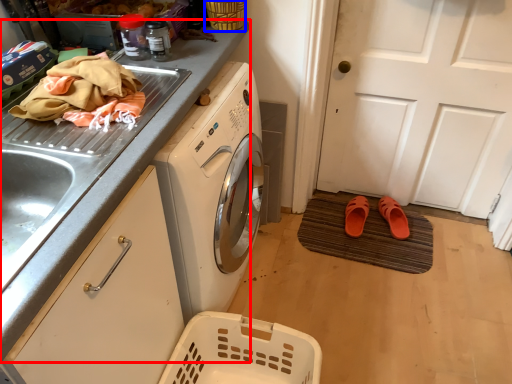
Question: Which of the following is the farthest to the observer, countertop (highlighted by a red box) or basket (highlighted by a blue box)?

Choices:
 (A) countertop
 (B) basket

Answer: (B)